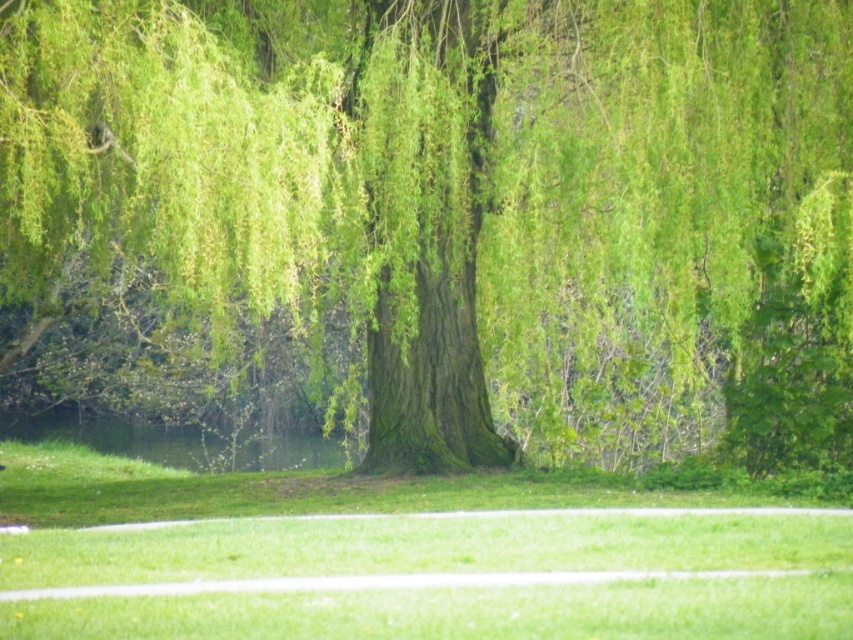
Question: Is green leafy willow at center to the right of green grass at lower center from the viewer's perspective?

Choices:
 (A) no
 (B) yes

Answer: (A)

Question: Is green leafy willow at center to the right of green grass at lower center from the viewer's perspective?

Choices:
 (A) no
 (B) yes

Answer: (A)

Question: Among these points, which one is farthest from the camera?

Choices:
 (A) (641, 588)
 (B) (73, 156)

Answer: (B)

Question: Does green leafy willow at center appear on the left side of green grass at lower center?

Choices:
 (A) yes
 (B) no

Answer: (A)